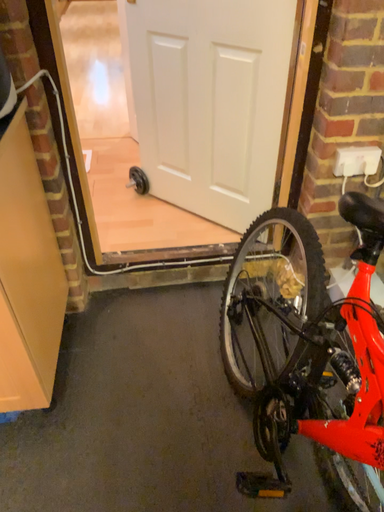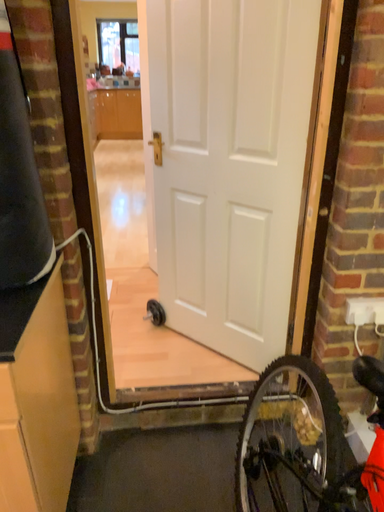
Question: Which way did the camera rotate in the video?

Choices:
 (A) rotated downward
 (B) rotated upward

Answer: (B)